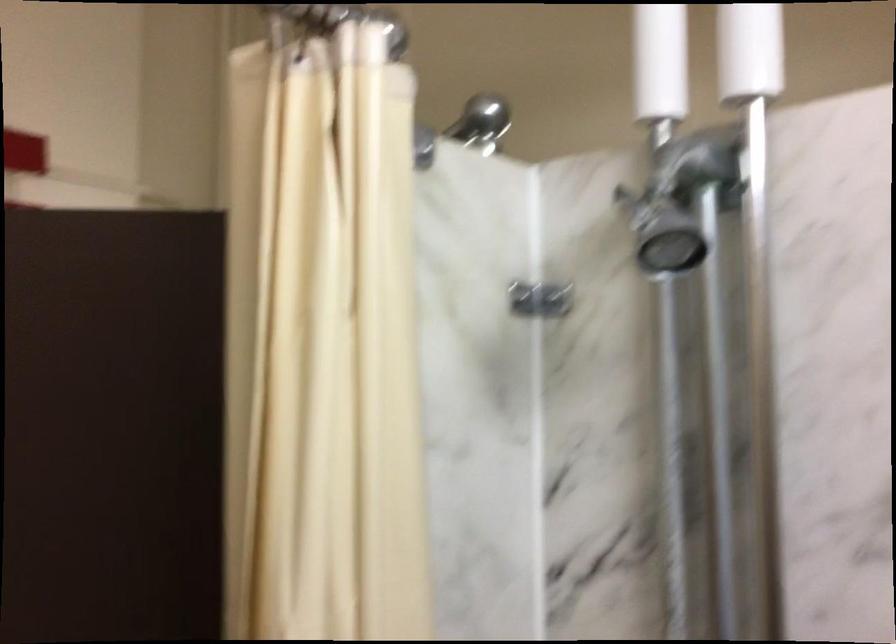
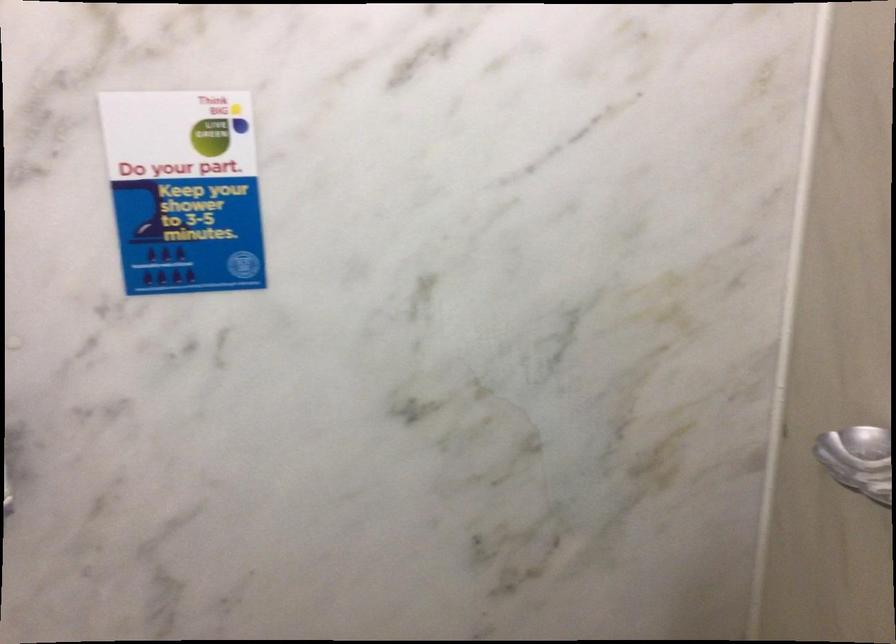
First-person continuous shooting, in which direction is the camera rotating?

The camera rotated toward right-down.